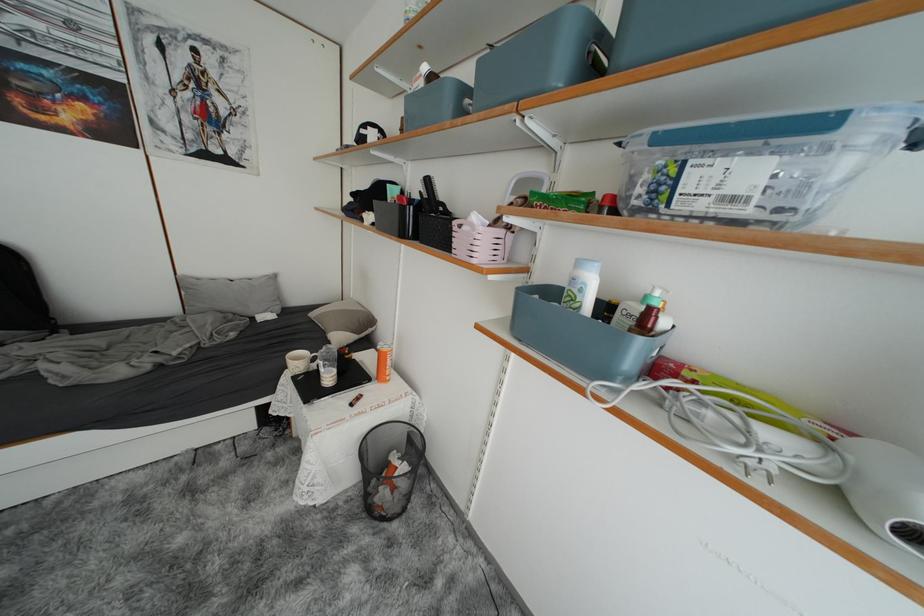
Find the location of a particular element. white appliance handle is located at coordinates (754, 435).